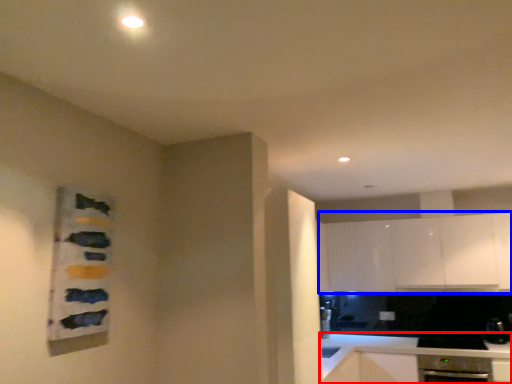
Question: Which of the following is the closest to the observer, countertop (highlighted by a red box) or cabinetry (highlighted by a blue box)?

Choices:
 (A) countertop
 (B) cabinetry

Answer: (A)